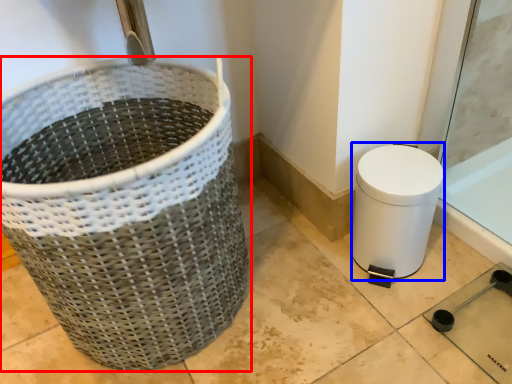
Question: Which object appears farthest to the camera in this image, waste container (highlighted by a red box) or toilet bowl (highlighted by a blue box)?

Choices:
 (A) waste container
 (B) toilet bowl

Answer: (B)